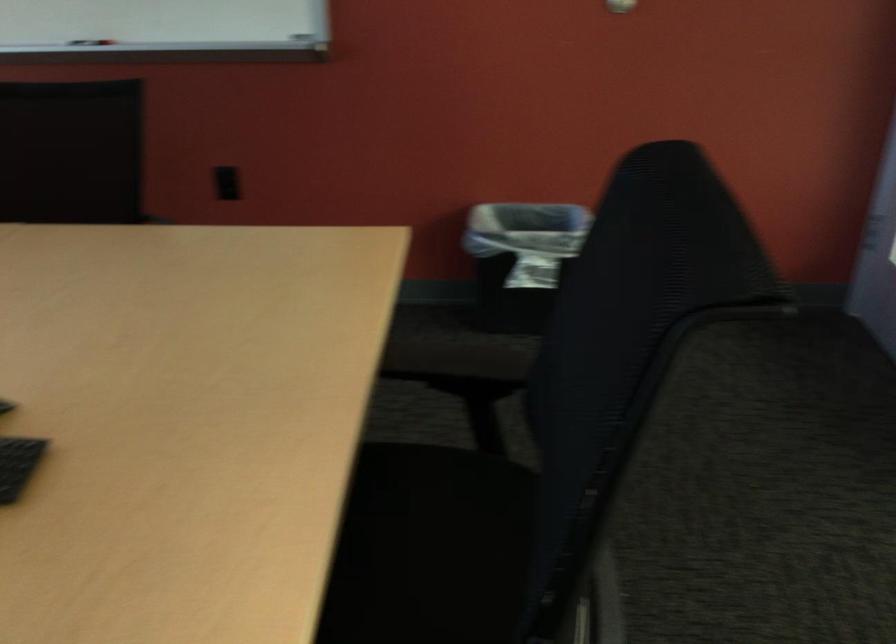
I want to click on chair sitting surface, so click(412, 532).